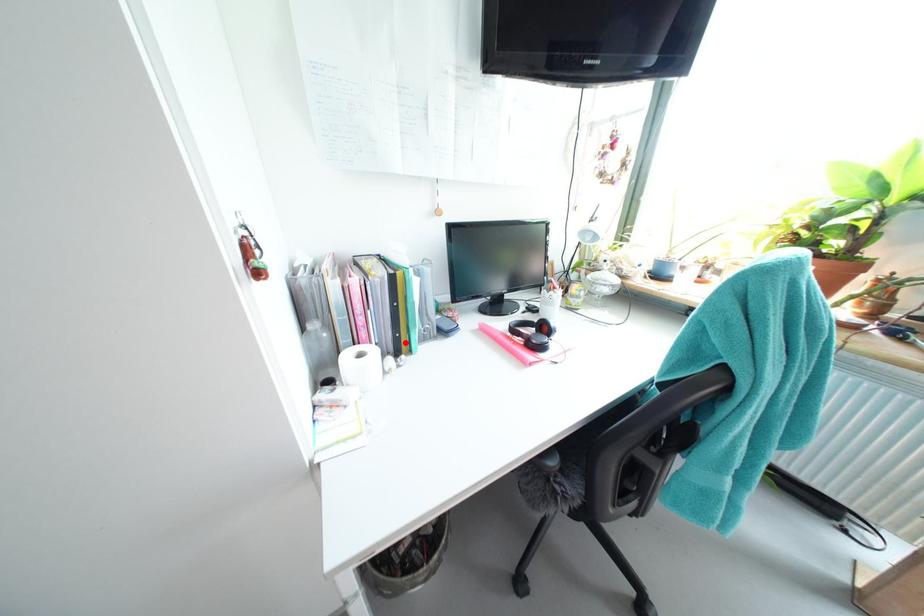
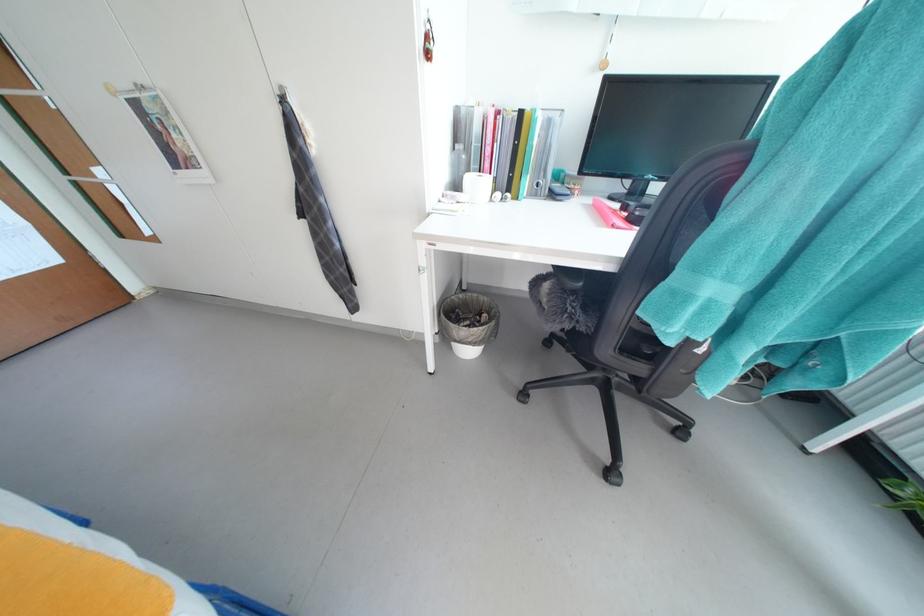
Locate, in the second image, the point that corresponds to the highlighted location in the first image.

(517, 183)